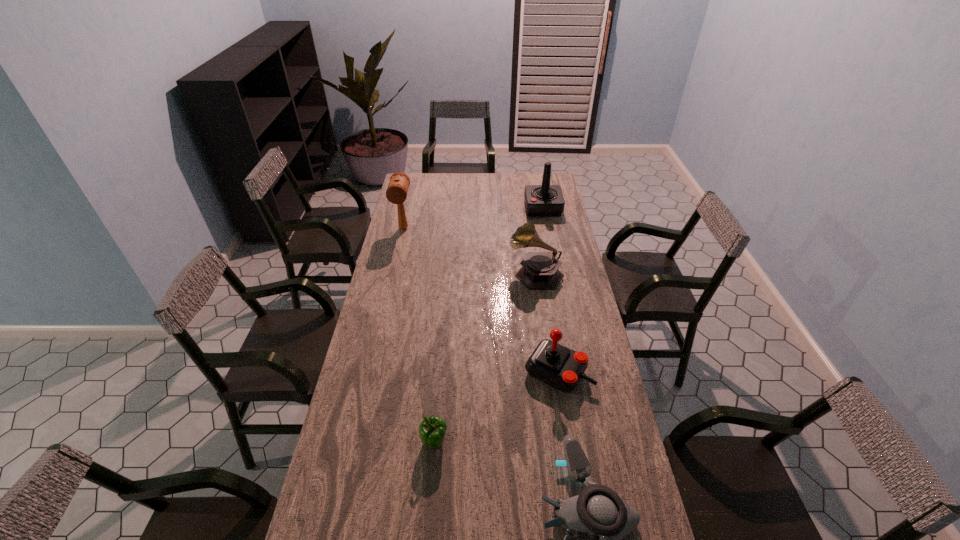
The height and width of the screenshot is (540, 960). Identify the location of object that is the closest to the fifth tallest object. (598, 510).

The width and height of the screenshot is (960, 540). In order to click on vacant space that satisfies the following two spatial constraints: 1. on the horn direction of the shorter joystick; 2. on the left side of the fourth nearest object in this screenshot , I will do `click(551, 372)`.

Locate an element on the screen. The width and height of the screenshot is (960, 540). blank area in the image that satisfies the following two spatial constraints: 1. on the back side of the second object from left to right; 2. on the left side of the third nearest object is located at coordinates 441,372.

Image resolution: width=960 pixels, height=540 pixels. I want to click on free space in the image that satisfies the following two spatial constraints: 1. on the strike surface of the second shortest object; 2. on the left side of the leftmost object, so click(x=354, y=443).